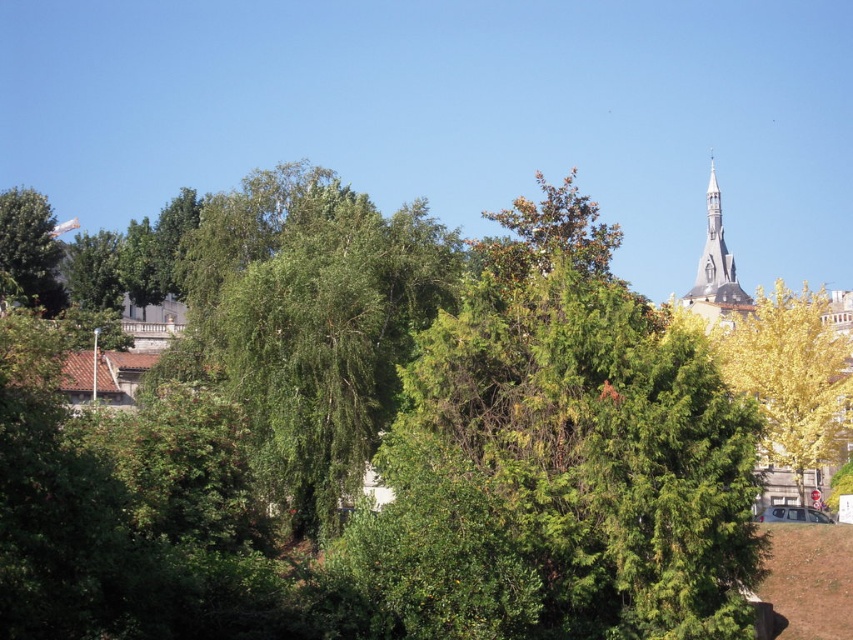
You are standing at the point with coordinates point (798,472) and want to move towards point (39,225). Given that the path between them is clear, will you be moving towards the foreground or background of the image?

Since point (798,472) is closer to the camera than point (39,225), moving from point (798,472) towards point (39,225) means you are moving away from the foreground and towards the background of the image.